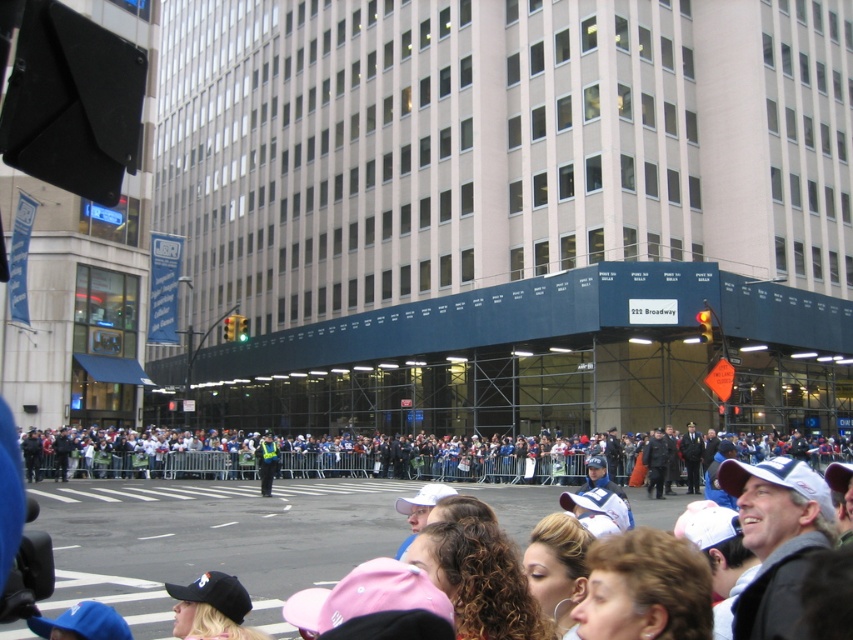
Is point (108, 436) less distant than point (267, 438)?

No, (108, 436) is behind (267, 438).

The image size is (853, 640). Identify the location of white plastic crowd at center. (434, 460).

I want to click on white plastic crowd at center, so click(x=434, y=460).